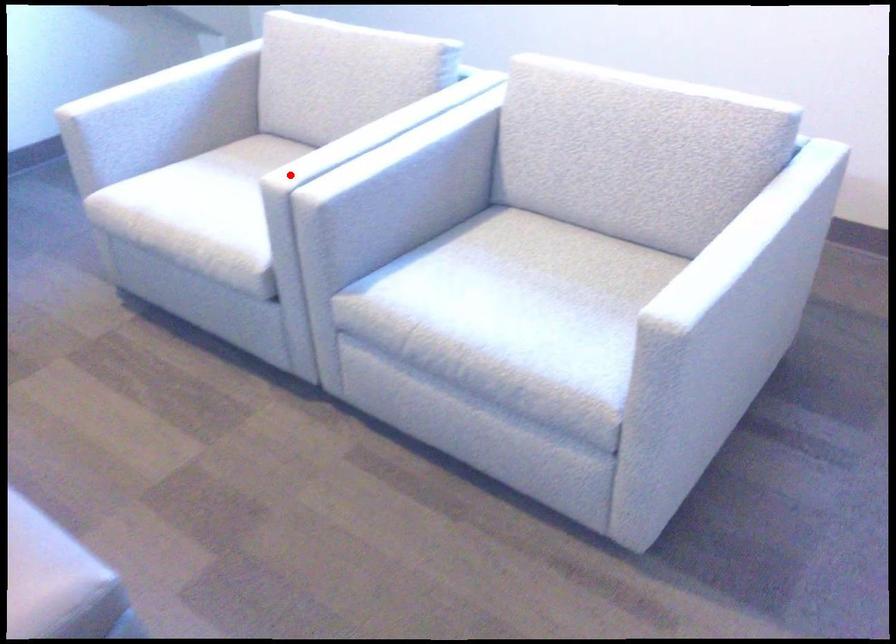
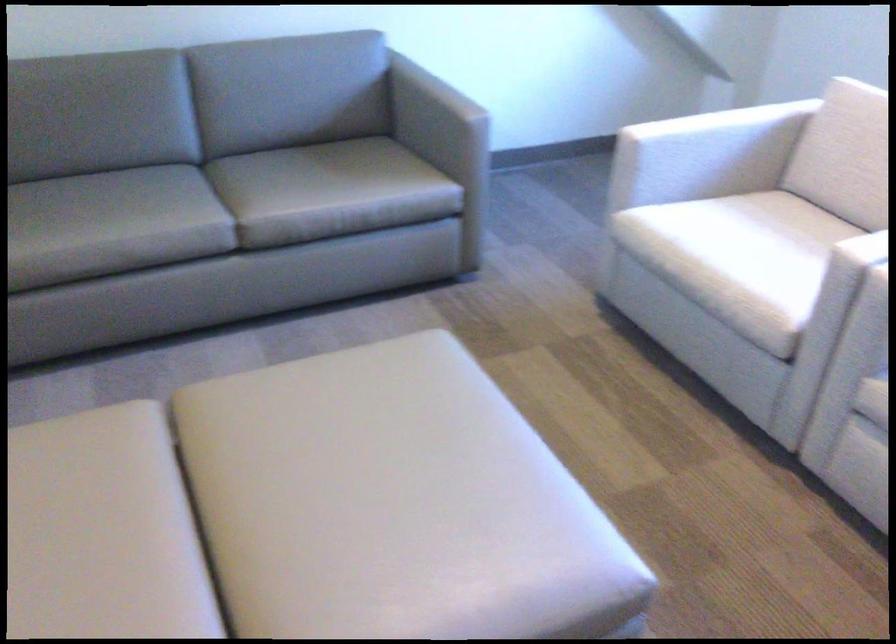
The point at the highlighted location is marked in the first image. Where is the corresponding point in the second image?

(872, 250)